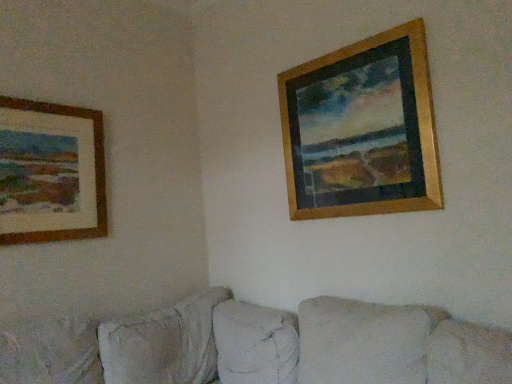
Question: Based on their positions, is wooden frame at left, positioned as the 1th picture frame in left-to-right order, located to the left or right of beige fabric couch at lower center?

Choices:
 (A) left
 (B) right

Answer: (A)

Question: From the image's perspective, is wooden frame at left, positioned as the 1th picture frame in left-to-right order, positioned above or below beige fabric couch at lower center?

Choices:
 (A) below
 (B) above

Answer: (B)

Question: Estimate the real-world distances between objects in this image. Which object is farther from the wooden frame at upper right, which appears as the first picture frame when viewed from the right?

Choices:
 (A) beige fabric couch at lower center
 (B) wooden frame at left, positioned as the 1th picture frame in left-to-right order

Answer: (B)

Question: Which object is positioned closest to the wooden frame at left, which ranks as the second picture frame in right-to-left order?

Choices:
 (A) wooden frame at upper right, the 2th picture frame from the left
 (B) beige fabric couch at lower center

Answer: (B)